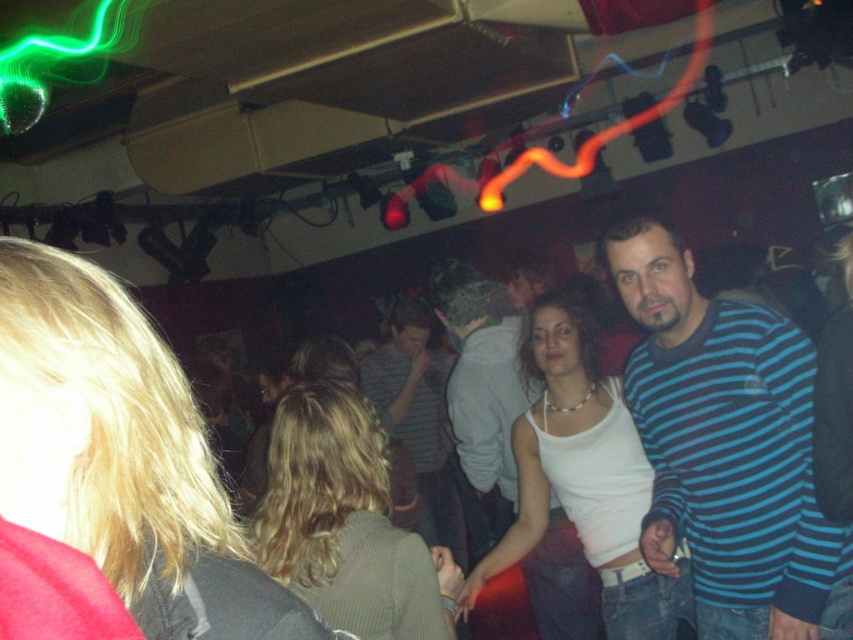
The image size is (853, 640). What do you see at coordinates (727, 449) in the screenshot?
I see `blue striped sweater at right` at bounding box center [727, 449].

Can you confirm if blue striped sweater at right is smaller than blonde hair at center?

No.

Which is behind, point (695, 374) or point (434, 561)?

Point (695, 374)

This screenshot has height=640, width=853. What are the coordinates of `blue striped sweater at right` in the screenshot? It's located at click(727, 449).

Can you confirm if blonde hair at upper left is smaller than striped cotton shirt at center?

Yes, blonde hair at upper left is smaller than striped cotton shirt at center.

Describe the element at coordinates (122, 456) in the screenshot. I see `blonde hair at upper left` at that location.

Identify the location of blonde hair at upper left. Image resolution: width=853 pixels, height=640 pixels. (122, 456).

Identify the location of blonde hair at upper left. The image size is (853, 640). (122, 456).

Can you confirm if white matte tank top at center is taller than striped cotton shirt at center?

No, white matte tank top at center is not taller than striped cotton shirt at center.

Which is above, white matte tank top at center or striped cotton shirt at center?

white matte tank top at center is above.

Where is `white matte tank top at center`? Image resolution: width=853 pixels, height=640 pixels. white matte tank top at center is located at coordinates (584, 477).